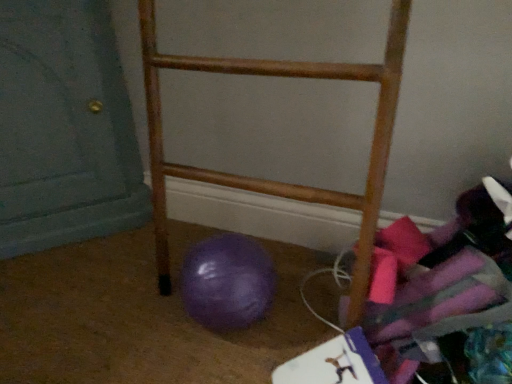
Where is `blank area beneath wooden rack at center (from a real-world perspective)`? This screenshot has height=384, width=512. blank area beneath wooden rack at center (from a real-world perspective) is located at coordinates (303, 275).